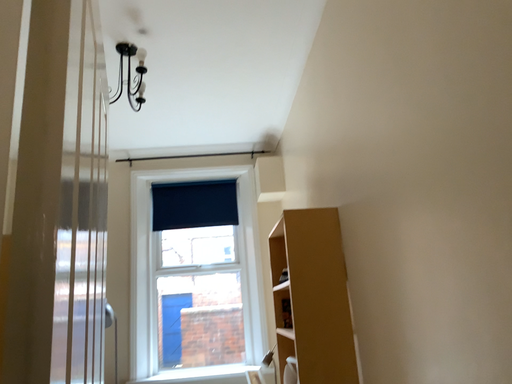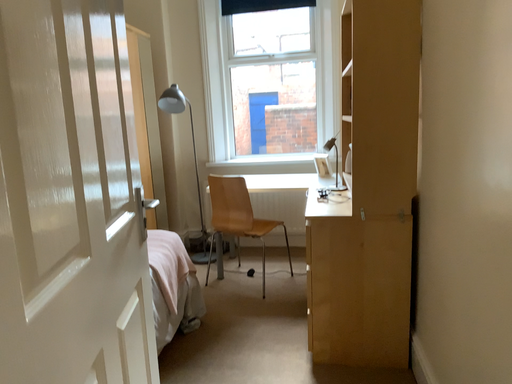
Question: How did the camera likely rotate when shooting the video?

Choices:
 (A) rotated downward
 (B) rotated upward

Answer: (A)